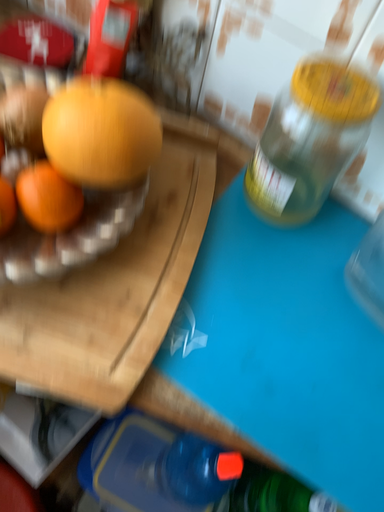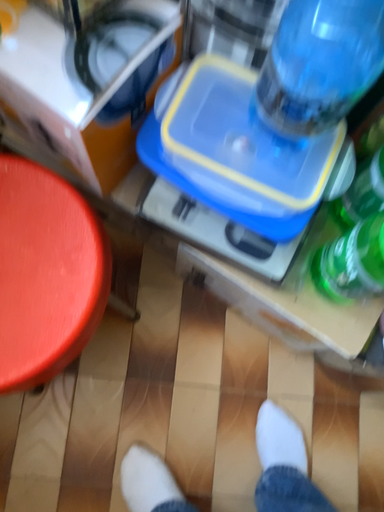
Question: Which way did the camera rotate in the video?

Choices:
 (A) rotated downward
 (B) rotated upward

Answer: (A)